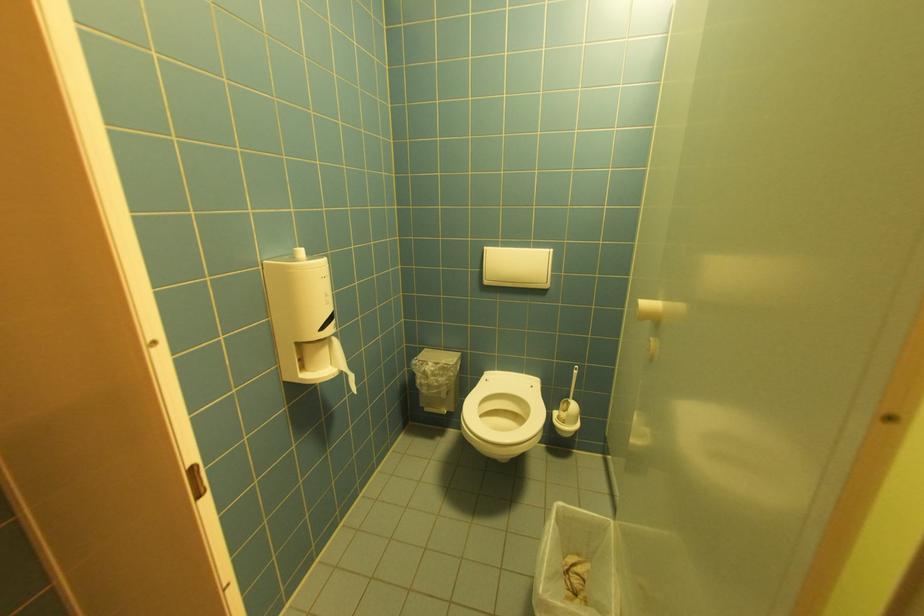
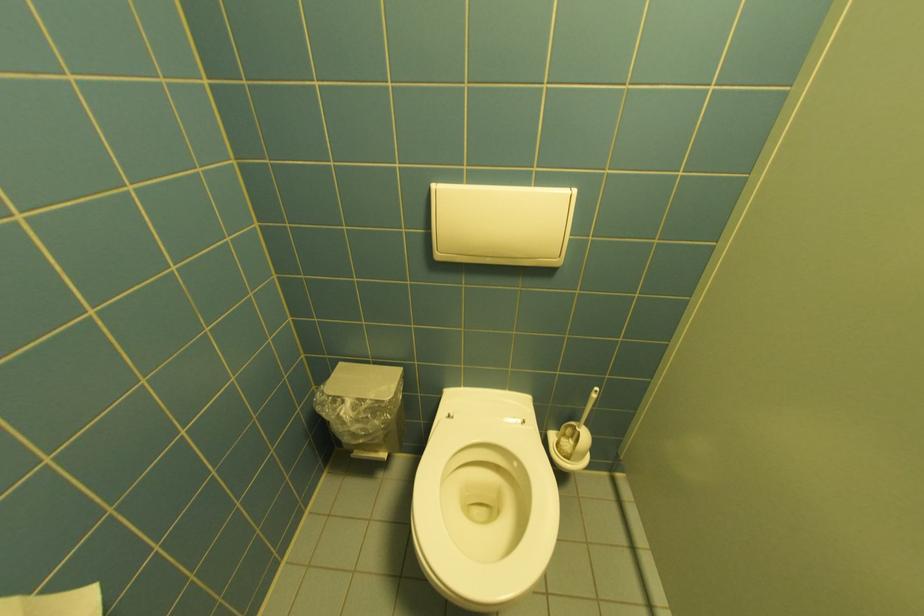
Question: Which direction would the cameraman need to move to produce the second image? Reply with the corresponding letter.

Choices:
 (A) Left
 (B) Right
 (C) Forward
 (D) Backward

Answer: (C)